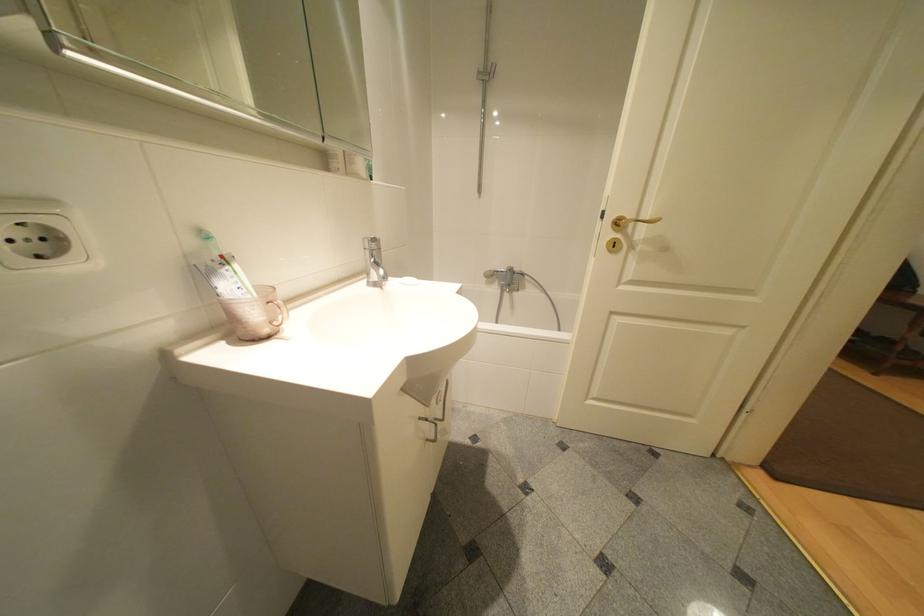
You are a GUI agent. You are given a task and a screenshot of the screen. Output one action in this format:
    pyautogui.click(x=<x>, y=<y>)
    Task: Click on the white bar of soap
    This screenshot has height=616, width=924.
    Given the screenshot: What is the action you would take?
    pyautogui.click(x=408, y=284)